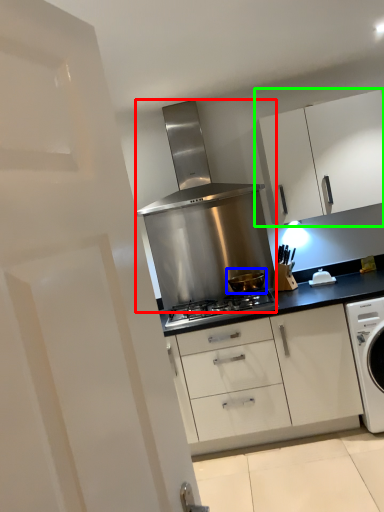
Question: Which is nearer to the home appliance (highlighted by a red box)? kitchen appliance (highlighted by a blue box) or cabinetry (highlighted by a green box).

Choices:
 (A) kitchen appliance
 (B) cabinetry

Answer: (A)